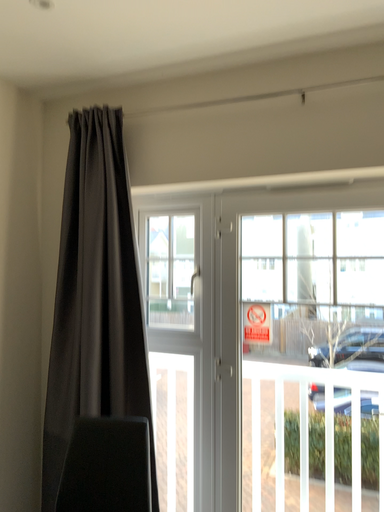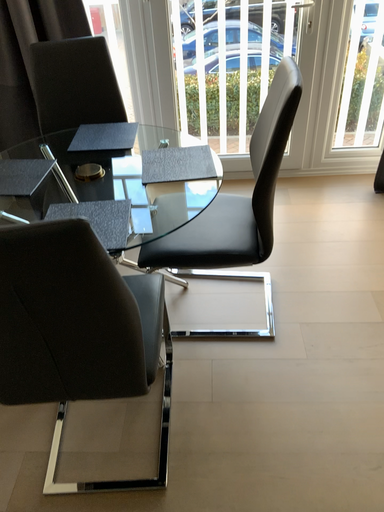
Question: How did the camera likely rotate when shooting the video?

Choices:
 (A) rotated right
 (B) rotated left

Answer: (A)